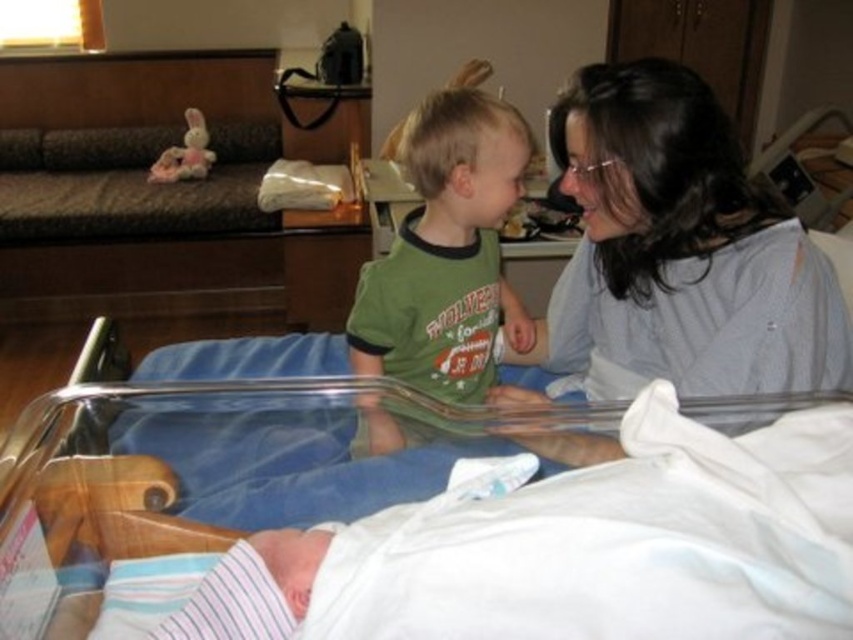
From the picture: Can you confirm if matte gray shirt at upper right is thinner than white fabric infant bed at center?

Yes, matte gray shirt at upper right is thinner than white fabric infant bed at center.

Who is lower down, matte gray shirt at upper right or white fabric infant bed at center?

white fabric infant bed at center is lower down.

Find the location of a particular element. matte gray shirt at upper right is located at coordinates (680, 250).

Which is more to the right, white fabric infant bed at center or green cotton shirt at center?

From the viewer's perspective, green cotton shirt at center appears more on the right side.

This screenshot has width=853, height=640. Describe the element at coordinates (223, 452) in the screenshot. I see `white fabric infant bed at center` at that location.

The width and height of the screenshot is (853, 640). Identify the location of white fabric infant bed at center. (223, 452).

The height and width of the screenshot is (640, 853). I want to click on white fabric infant bed at center, so click(223, 452).

Can you confirm if matte gray shirt at upper right is shorter than green cotton shirt at center?

Indeed, matte gray shirt at upper right has a lesser height compared to green cotton shirt at center.

Does point (712, 365) come in front of point (473, 312)?

Yes, point (712, 365) is closer to viewer.

Identify the location of matte gray shirt at upper right. This screenshot has height=640, width=853. (680, 250).